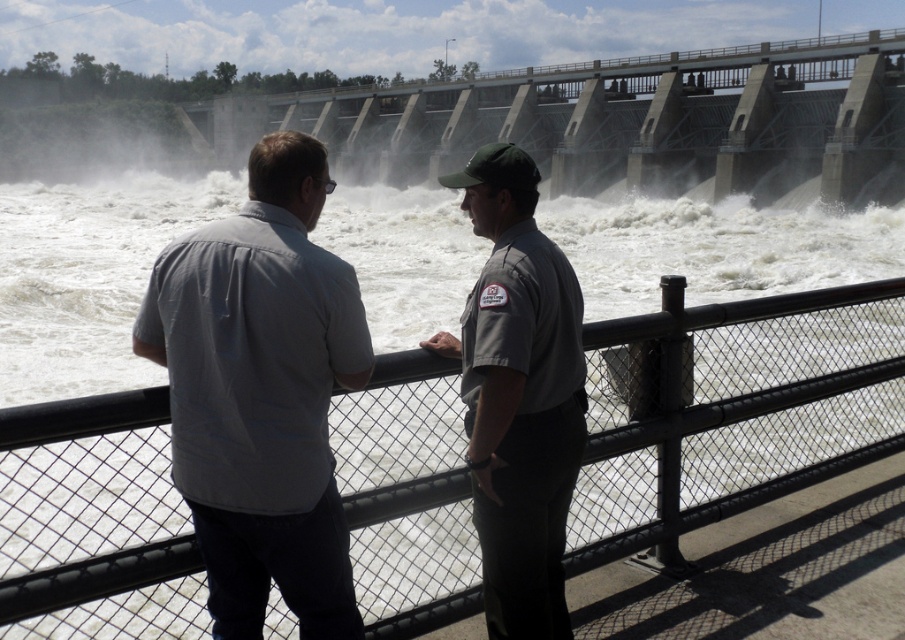
You are a safety inspector assessing the dam structure. You notice the concrete dam at center and the gray uniform at center. Which object is taller in the image?

The concrete dam at center is taller than the gray uniform at center.

Based on the coordinates provided, which object is located at point (262, 394)?

The gray cotton shirt at center is located at point (262, 394).